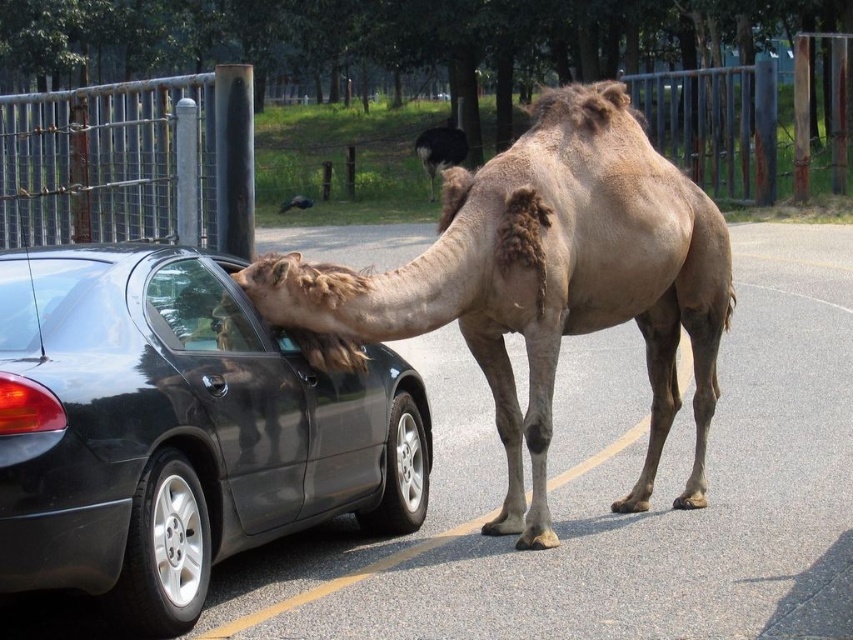
Question: Which object is the closest to the fuzzy brown camel at center?

Choices:
 (A) satin black car at left
 (B) light brown fur camel at center

Answer: (B)

Question: Estimate the real-world distances between objects in this image. Which object is farther from the satin black car at left?

Choices:
 (A) light brown fur camel at center
 (B) fuzzy brown camel at center

Answer: (B)

Question: Is satin black car at left behind light brown fur camel at center?

Choices:
 (A) no
 (B) yes

Answer: (A)

Question: Which object is the farthest from the light brown fur camel at center?

Choices:
 (A) satin black car at left
 (B) fuzzy brown camel at center

Answer: (B)

Question: Does satin black car at left have a greater width compared to light brown fur camel at center?

Choices:
 (A) no
 (B) yes

Answer: (B)

Question: Is satin black car at left to the right of light brown fur camel at center from the viewer's perspective?

Choices:
 (A) yes
 (B) no

Answer: (B)